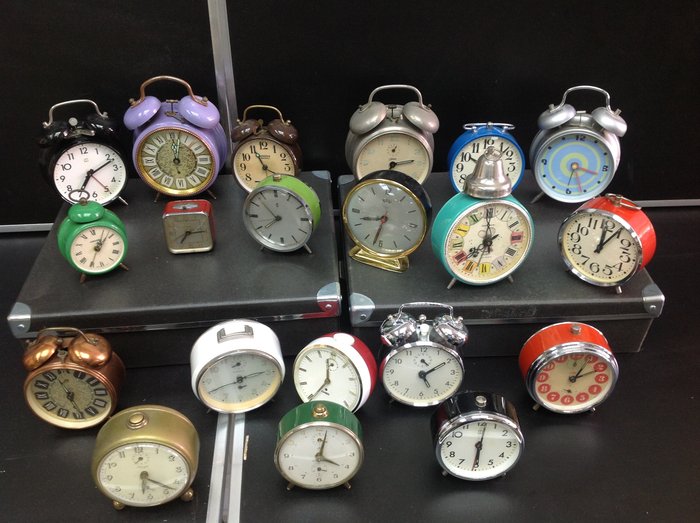
At what (x,y) coordinates should I click in order to perform the action: click on purple clock. Please return your answer as a coordinate pair (x, y). Image resolution: width=700 pixels, height=523 pixels. Looking at the image, I should click on (176, 124).